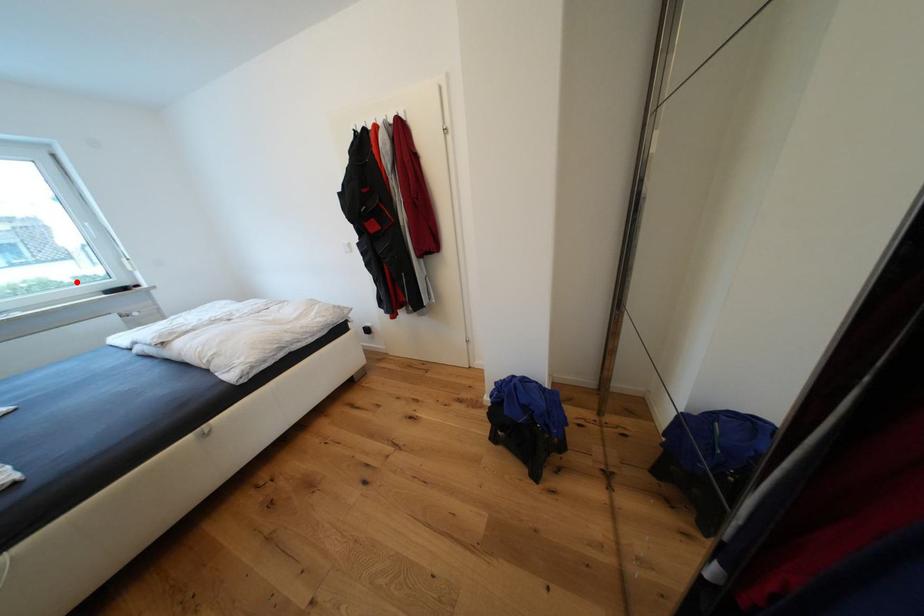
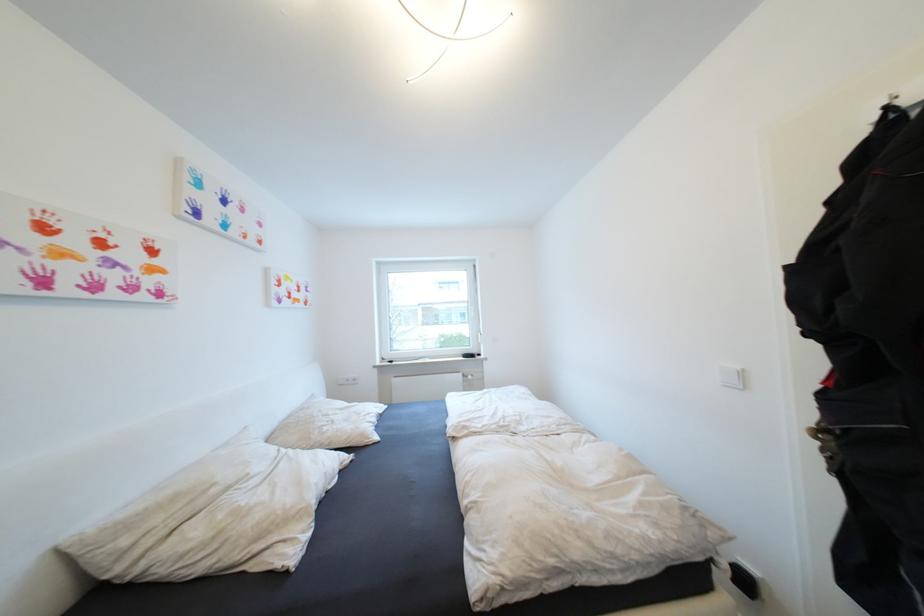
Question: I am providing you with two images of the same scene from different viewpoints. In image1, a red point is highlighted. Considering the same 3D point in image2, which of the following is correct?

Choices:
 (A) It is closer
 (B) It is farther

Answer: (B)